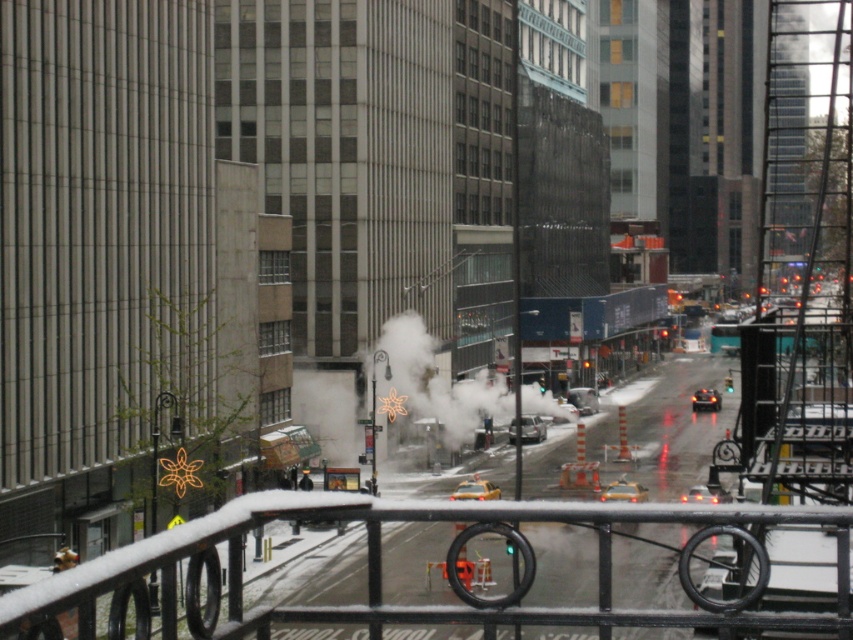
You are standing on a balcony with a black metal railing in the foreground. You want to take a photo of the silver metallic sedan at center. Where should you aim your camera to capture it in the frame?

You should aim your camera at the point with coordinates (532, 428) to capture the silver metallic sedan at center in the frame.

You are standing on a balcony with a black metal railing and looking down at the street below. You see a silver metallic sedan at center and a shiny black car at center. Which car is positioned to the left when viewed from the street level?

The silver metallic sedan at center is positioned to the left of the shiny black car at center when viewed from the street level.

You are a delivery drone with a wingspan of 1.8 meters. You need to fly from the silver metallic sedan at center to the shiny black car at center. Is there enough space between them for your drone to pass through?

The distance between the silver metallic sedan at center and the shiny black car at center is 22.42 meters, so yes, the drone can pass through as the distance is more than sufficient for its 1.8 meter wingspan.